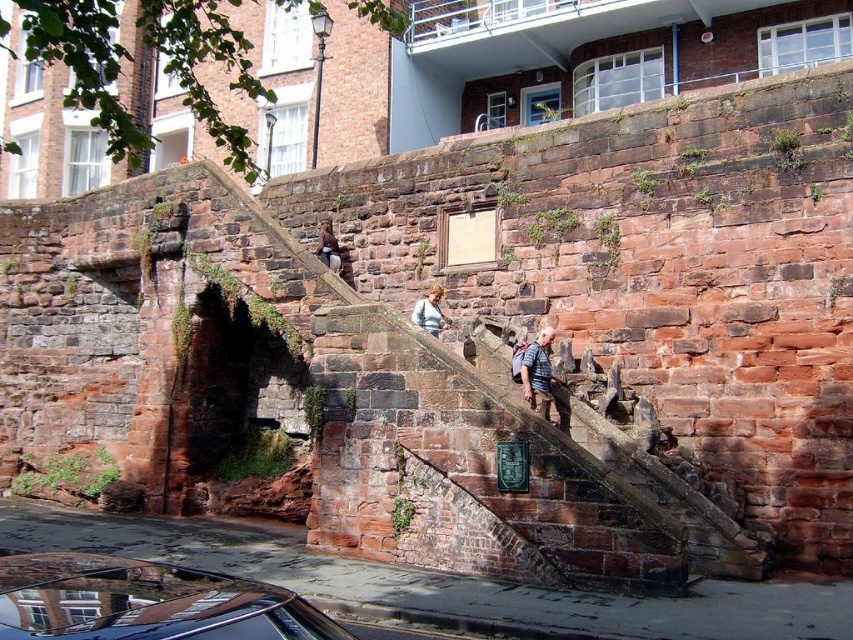
Is point (218, 627) behind point (329, 227)?

No, (218, 627) is closer to viewer.

Does shiny black car at lower left have a smaller size compared to brown leather jacket at center?

Incorrect, shiny black car at lower left is not smaller in size than brown leather jacket at center.

Where is `shiny black car at lower left`? The height and width of the screenshot is (640, 853). shiny black car at lower left is located at coordinates (144, 602).

This screenshot has height=640, width=853. Describe the element at coordinates (430, 310) in the screenshot. I see `smooth gray sweater at center` at that location.

Does point (434, 305) come closer to viewer compared to point (318, 241)?

Yes.

Is point (427, 316) more distant than point (335, 257)?

No.

At what (x,y) coordinates should I click in order to perform the action: click on smooth gray sweater at center. Please return your answer as a coordinate pair (x, y). The width and height of the screenshot is (853, 640). Looking at the image, I should click on (430, 310).

Who is more distant from viewer, (103,634) or (532,364)?

The point (532,364) is more distant.

Locate an element on the screen. shiny black car at lower left is located at coordinates (144, 602).

Locate an element on the screen. The image size is (853, 640). shiny black car at lower left is located at coordinates (144, 602).